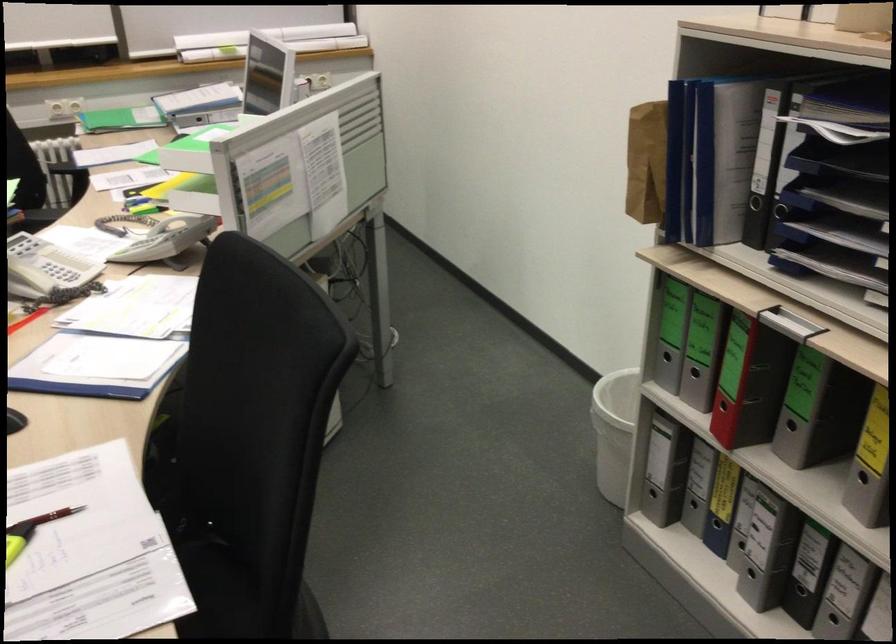
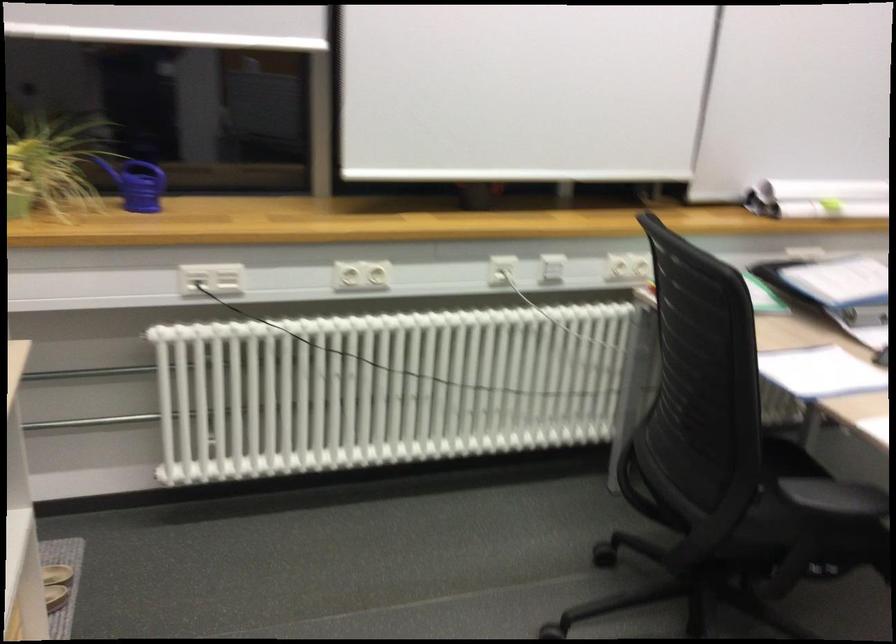
What movement of the cameraman would produce the second image?

The cameraman moved toward left, forward.